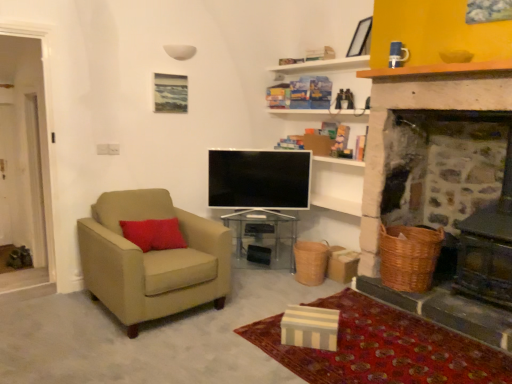
What are the coordinates of `free point in front of transparent acrylic table at center` in the screenshot? It's located at (267, 287).